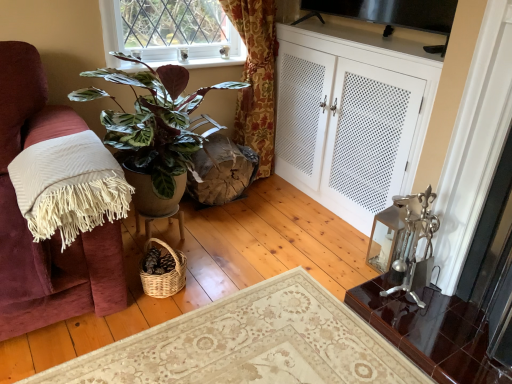
Question: Visually, is white perforated cabinet at right positioned to the left or to the right of green leafy plant at upper center?

Choices:
 (A) left
 (B) right

Answer: (B)

Question: Considering their positions, is white perforated cabinet at right located in front of or behind green leafy plant at upper center?

Choices:
 (A) behind
 (B) front

Answer: (B)

Question: Estimate the real-world distances between objects in this image. Which object is closer to the matte brown swivel chair at center?

Choices:
 (A) glossy dark brown desk at lower right
 (B) white perforated cabinet at right
 (C) green glossy plant at left
 (D) green leafy plant at upper center
 (E) white fringed blanket at left

Answer: (C)

Question: Considering the real-world distances, which object is closest to the white fringed blanket at left?

Choices:
 (A) white perforated cabinet at right
 (B) green leafy plant at upper center
 (C) green glossy plant at left
 (D) matte brown swivel chair at center
 (E) glossy dark brown desk at lower right

Answer: (C)